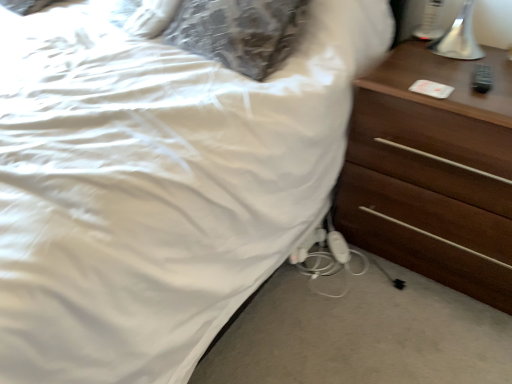
At what (x,y) coordinates should I click in order to perform the action: click on empty space that is ontop of brown wood chest of drawers at right (from a real-world perspective). Please return your answer as a coordinate pair (x, y). Looking at the image, I should click on (459, 73).